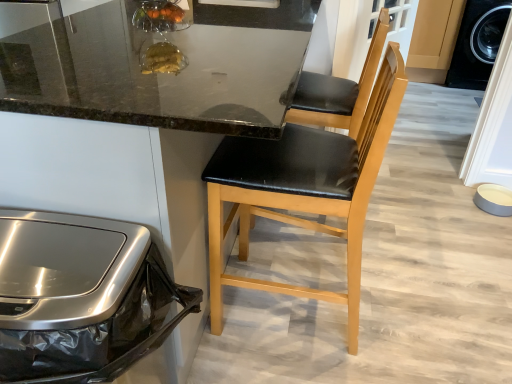
Where is `free space above matte gray bowl at lower right (from a real-world perspective)`? The image size is (512, 384). free space above matte gray bowl at lower right (from a real-world perspective) is located at coordinates (490, 193).